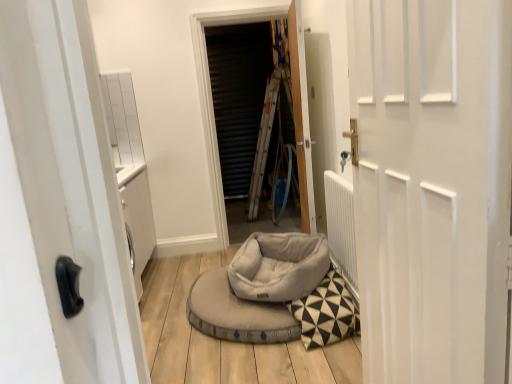
Question: Are metallic silver screen at center and white matte door at center, which is the 2th door from back to front, beside each other?

Choices:
 (A) yes
 (B) no

Answer: (B)

Question: From a real-world perspective, is metallic silver screen at center located higher than white matte door at center, which is counted as the 1th door, starting from the front?

Choices:
 (A) no
 (B) yes

Answer: (B)

Question: From a real-world perspective, is metallic silver screen at center under white matte door at center, which is the 2th door from back to front?

Choices:
 (A) yes
 (B) no

Answer: (B)

Question: Can you confirm if metallic silver screen at center is positioned to the right of white matte door at center, which is counted as the 1th door, starting from the front?

Choices:
 (A) yes
 (B) no

Answer: (B)

Question: Does metallic silver screen at center have a greater width compared to white matte door at center, which is the 2th door from back to front?

Choices:
 (A) yes
 (B) no

Answer: (A)

Question: From a real-world perspective, is soft gray fabric bean bag at center above or below white matte door at center, which is counted as the 1th door, starting from the front?

Choices:
 (A) below
 (B) above

Answer: (A)

Question: Based on their positions, is soft gray fabric bean bag at center located to the left or right of white matte door at center, which is counted as the 1th door, starting from the front?

Choices:
 (A) left
 (B) right

Answer: (A)

Question: From the image's perspective, relative to white matte door at center, which is the 2th door from back to front, is soft gray fabric bean bag at center above or below?

Choices:
 (A) below
 (B) above

Answer: (A)

Question: Choose the correct answer: Is soft gray fabric bean bag at center inside white matte door at center, which is counted as the 1th door, starting from the front, or outside it?

Choices:
 (A) outside
 (B) inside

Answer: (A)

Question: Considering the positions of wooden door at center, the first door viewed from the back, and soft gray fabric bean bag at center in the image, is wooden door at center, the first door viewed from the back, taller or shorter than soft gray fabric bean bag at center?

Choices:
 (A) short
 (B) tall

Answer: (B)

Question: Is wooden door at center, positioned as the 2th door in front-to-back order, to the left or to the right of soft gray fabric bean bag at center in the image?

Choices:
 (A) left
 (B) right

Answer: (B)

Question: Considering their positions, is wooden door at center, the first door viewed from the back, located in front of or behind soft gray fabric bean bag at center?

Choices:
 (A) behind
 (B) front

Answer: (A)

Question: Considering the positions of wooden door at center, the first door viewed from the back, and soft gray fabric bean bag at center in the image, is wooden door at center, the first door viewed from the back, bigger or smaller than soft gray fabric bean bag at center?

Choices:
 (A) big
 (B) small

Answer: (A)

Question: From a real-world perspective, relative to soft gray fabric bean bag at center, is metallic silver screen at center vertically above or below?

Choices:
 (A) above
 (B) below

Answer: (A)

Question: Is point click(302, 200) closer or farther from the camera than point click(245, 286)?

Choices:
 (A) farther
 (B) closer

Answer: (A)